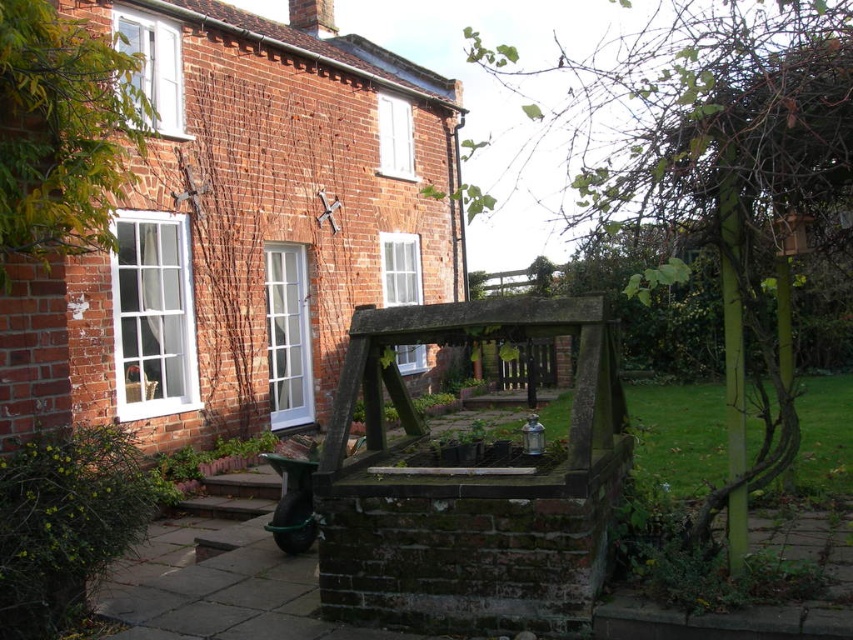
Question: Considering the relative positions of green leafy bush at lower left and brown wooden stairs at lower left in the image provided, where is green leafy bush at lower left located with respect to brown wooden stairs at lower left?

Choices:
 (A) below
 (B) above

Answer: (B)

Question: Is green leafy bush at lower left closer to camera compared to brown wooden stairs at lower left?

Choices:
 (A) no
 (B) yes

Answer: (B)

Question: Which of the following is the farthest from the observer?

Choices:
 (A) brown wooden stairs at lower left
 (B) green leafy bush at lower left

Answer: (A)

Question: Is the position of green leafy bush at lower left more distant than that of brown wooden stairs at lower left?

Choices:
 (A) no
 (B) yes

Answer: (A)